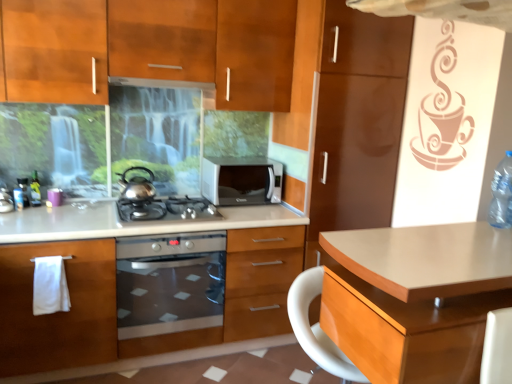
Question: From the image's perspective, relative to matte wood cabinets at upper center, the second cabinetry when ordered from bottom to top, is satin silver gas stove at center above or below?

Choices:
 (A) below
 (B) above

Answer: (A)

Question: From their relative heights in the image, would you say satin silver gas stove at center is taller or shorter than matte wood cabinets at upper center, the second cabinetry when ordered from bottom to top?

Choices:
 (A) tall
 (B) short

Answer: (B)

Question: Based on their relative distances, which object is nearer to the clear plastic bottle at right, placed as the second bottle when sorted from left to right?

Choices:
 (A) satin silver microwave at center
 (B) satin silver oven at center
 (C) metallic silver bottle at left, which is the second bottle in front-to-back order
 (D) matte wood cabinets at upper center, which appears as the first cabinetry when viewed from the top
 (E) matte wood desk at center

Answer: (E)

Question: Which is nearer to the clear plastic bottle at right, placed as the second bottle when sorted from left to right?

Choices:
 (A) matte wood oven at center, marked as the first cabinetry in a bottom-to-top arrangement
 (B) satin silver microwave at center
 (C) satin silver gas stove at center
 (D) matte wood cabinets at upper center, which appears as the first cabinetry when viewed from the top
 (E) matte stainless steel exhaust hood at upper center

Answer: (B)